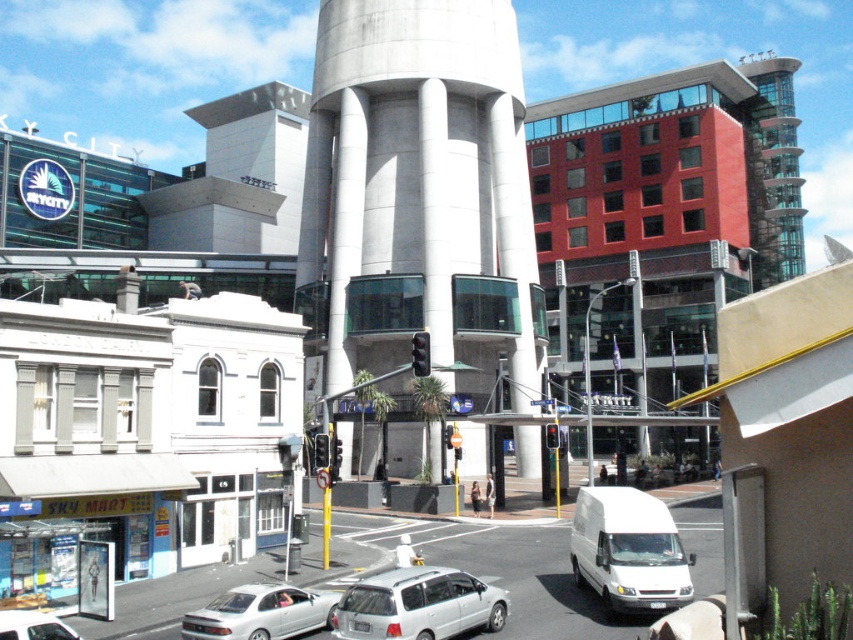
In the scene shown: You are a pedestrian standing at the crosswalk between the white matte van at lower right and the silver metallic sedan at lower left. Which vehicle is closer to you?

The white matte van at lower right is closer to you because it is further to the viewer than the silver metallic sedan at lower left, meaning it appears nearer in the image.

You are a delivery driver who needs to turn left at the intersection. You see the concrete water tower at center and the white matte van at lower right. Which object should you use as a landmark to ensure you turn correctly?

You should use the concrete water tower at center as a landmark because it is to the left of the white matte van at lower right, indicating the direction you need to turn.